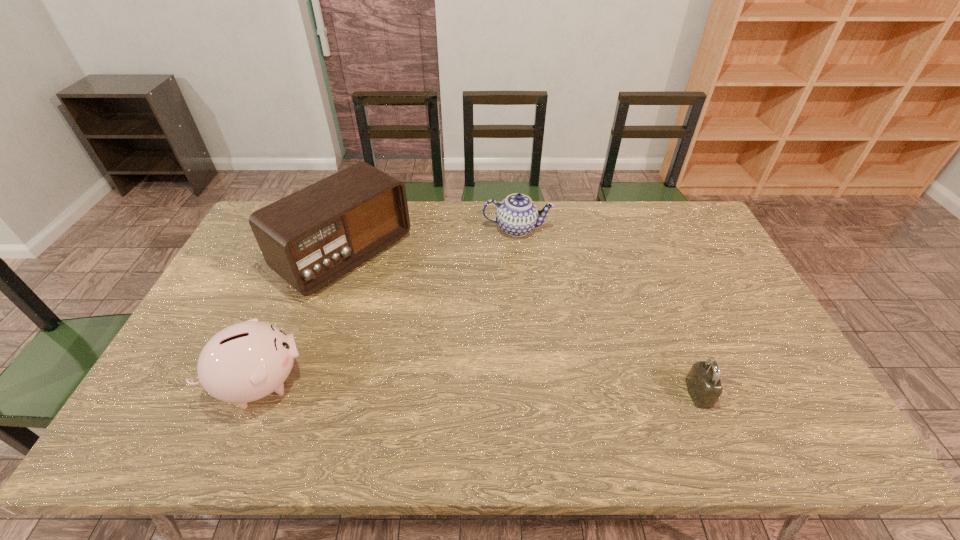
Locate an element on the screen. object present at the far left corner is located at coordinates (310, 238).

Locate an element on the screen. The width and height of the screenshot is (960, 540). object located at the near left corner is located at coordinates (247, 361).

Where is `free space at the far edge of the desktop`? This screenshot has width=960, height=540. free space at the far edge of the desktop is located at coordinates (660, 231).

You are a GUI agent. You are given a task and a screenshot of the screen. Output one action in this format:
    pyautogui.click(x=<x>, y=<y>)
    Task: Click on the vacant space at the near edge of the desktop
    The image size is (960, 540).
    Given the screenshot: What is the action you would take?
    pyautogui.click(x=437, y=399)

In order to click on free region at the right edge in this screenshot , I will do `click(771, 368)`.

Where is `free space at the far left corner`? free space at the far left corner is located at coordinates (252, 241).

Identify the location of free space at the near left corner. This screenshot has width=960, height=540. (207, 408).

The image size is (960, 540). I want to click on vacant space at the far right corner of the desktop, so click(660, 215).

The width and height of the screenshot is (960, 540). Find the location of `blank region between the piggy bank and the tallest object`. blank region between the piggy bank and the tallest object is located at coordinates (302, 319).

I want to click on free spot between the third tallest object and the radio receiver, so (x=431, y=242).